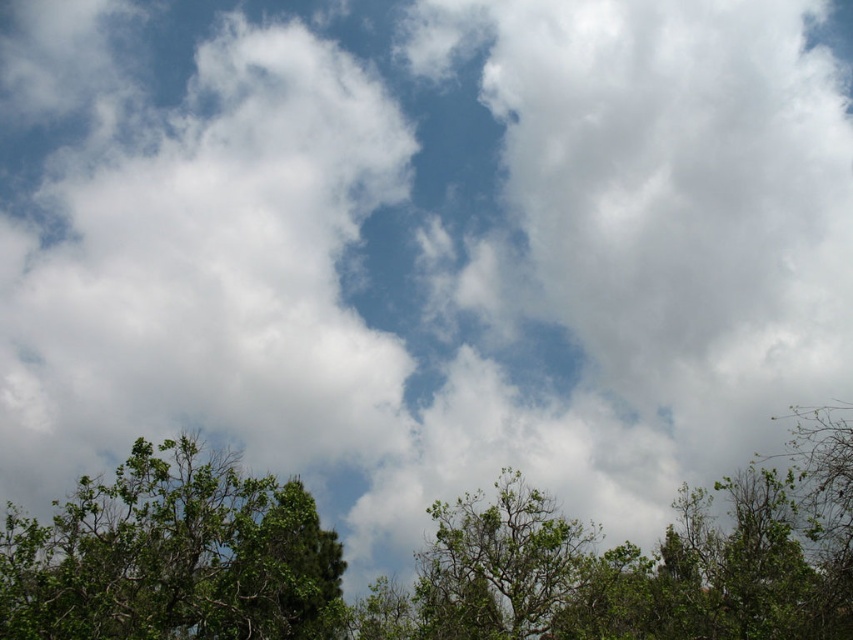
Question: Does green leafy tree at lower left come behind green leafy tree at center?

Choices:
 (A) no
 (B) yes

Answer: (A)

Question: Which point is farther to the camera?

Choices:
 (A) green leafy tree at center
 (B) green leafy tree at lower left

Answer: (A)

Question: Which point appears closest to the camera in this image?

Choices:
 (A) (573, 540)
 (B) (241, 576)

Answer: (B)

Question: Does green leafy tree at lower left have a greater width compared to green leafy tree at center?

Choices:
 (A) no
 (B) yes

Answer: (A)

Question: Does green leafy tree at lower left have a larger size compared to green leafy tree at center?

Choices:
 (A) yes
 (B) no

Answer: (B)